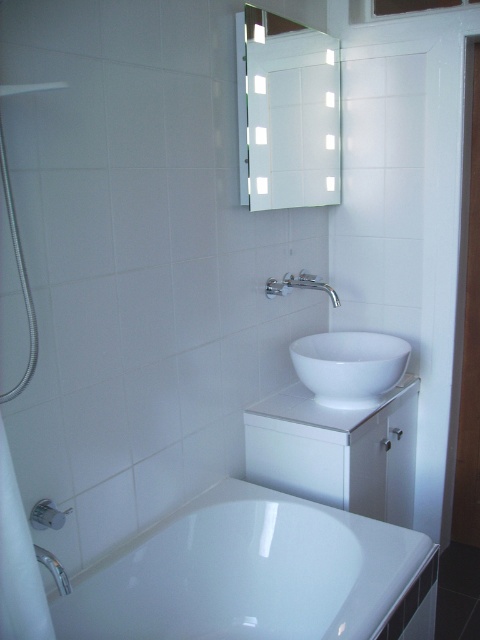
Question: Among these objects, which one is nearest to the camera?

Choices:
 (A) brushed metal shower at lower left
 (B) silver metallic faucet at upper center

Answer: (A)

Question: Is white glossy bathtub at lower left to the right of white glossy mirror at upper center from the viewer's perspective?

Choices:
 (A) yes
 (B) no

Answer: (B)

Question: Which object is farther from the camera taking this photo?

Choices:
 (A) silver metallic faucet at upper center
 (B) white glossy bowl at center

Answer: (A)

Question: Is brushed metal shower at lower left smaller than silver metallic faucet at upper center?

Choices:
 (A) yes
 (B) no

Answer: (A)

Question: Considering the real-world distances, which object is closest to the white glossy mirror at upper center?

Choices:
 (A) white glossy bathtub at lower left
 (B) brushed metal shower at lower left
 (C) white glossy bowl at center

Answer: (C)

Question: Can you confirm if white glossy mirror at upper center is positioned above white glossy bowl at center?

Choices:
 (A) no
 (B) yes

Answer: (B)